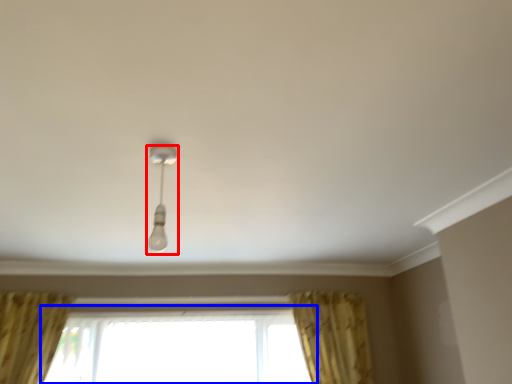
Question: Which point is closer to the camera, lamp (highlighted by a red box) or window (highlighted by a blue box)?

Choices:
 (A) lamp
 (B) window

Answer: (A)